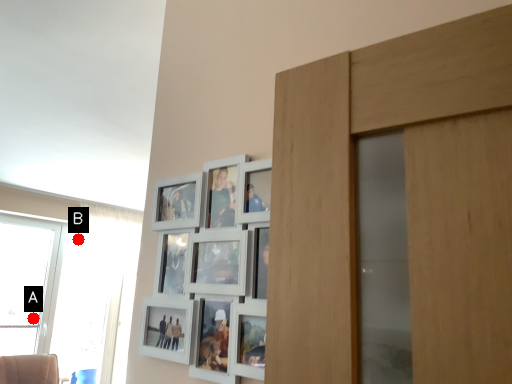
Question: Two points are circled on the image, labeled by A and B beside each circle. Which point is closer to the camera?

Choices:
 (A) A is closer
 (B) B is closer

Answer: (A)